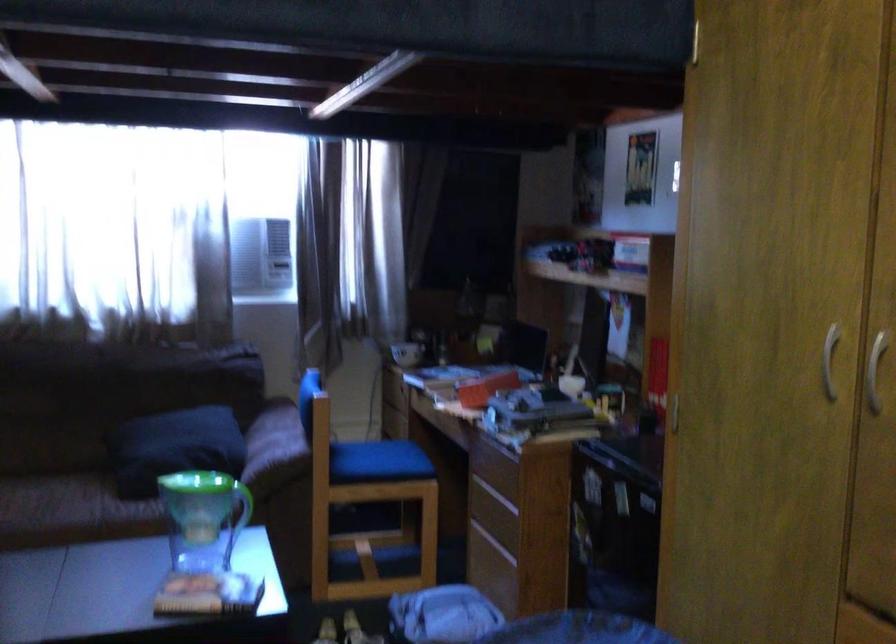
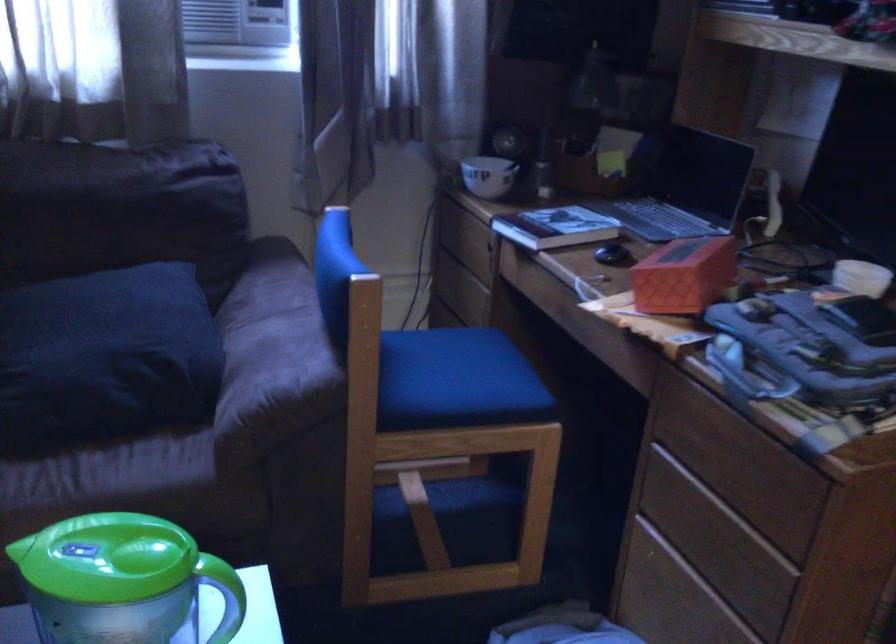
Where in the second image is the point corresponding to pixel 273 438 from the first image?

(274, 335)